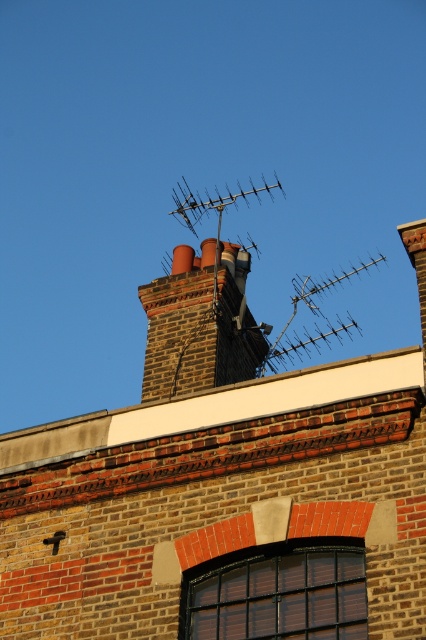
Can you confirm if brick chimney at center is positioned to the right of metallic antenna at upper center?

In fact, brick chimney at center is to the left of metallic antenna at upper center.

Is brick chimney at center positioned at the back of metallic antenna at upper center?

No.

Between point (161, 388) and point (281, 349), which one is positioned behind?

Positioned behind is point (281, 349).

Where is `brick chimney at center`? The image size is (426, 640). brick chimney at center is located at coordinates (199, 323).

In the scene shown: Between metallic antenna at upper center and metallic silver antenna at center, which one appears on the right side from the viewer's perspective?

metallic antenna at upper center

Is metallic antenna at upper center thinner than metallic silver antenna at center?

No, metallic antenna at upper center is not thinner than metallic silver antenna at center.

This screenshot has width=426, height=640. Find the location of `metallic antenna at upper center`. metallic antenna at upper center is located at coordinates (319, 317).

How distant is brick chimney at center from metallic silver antenna at center?

brick chimney at center is 11.18 meters from metallic silver antenna at center.

Is point (187, 348) positioned in front of point (218, 205)?

Yes, it is.

Image resolution: width=426 pixels, height=640 pixels. I want to click on brick chimney at center, so click(x=199, y=323).